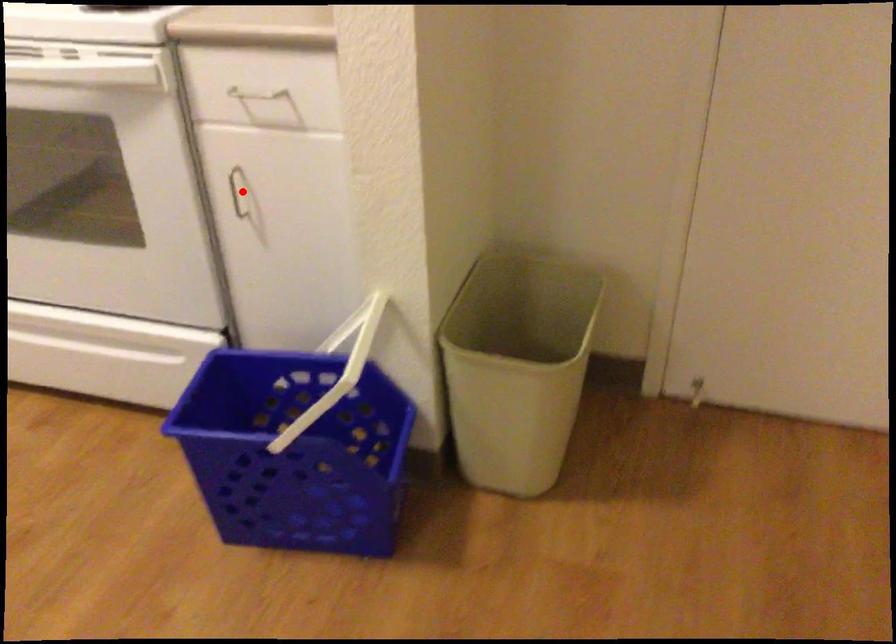
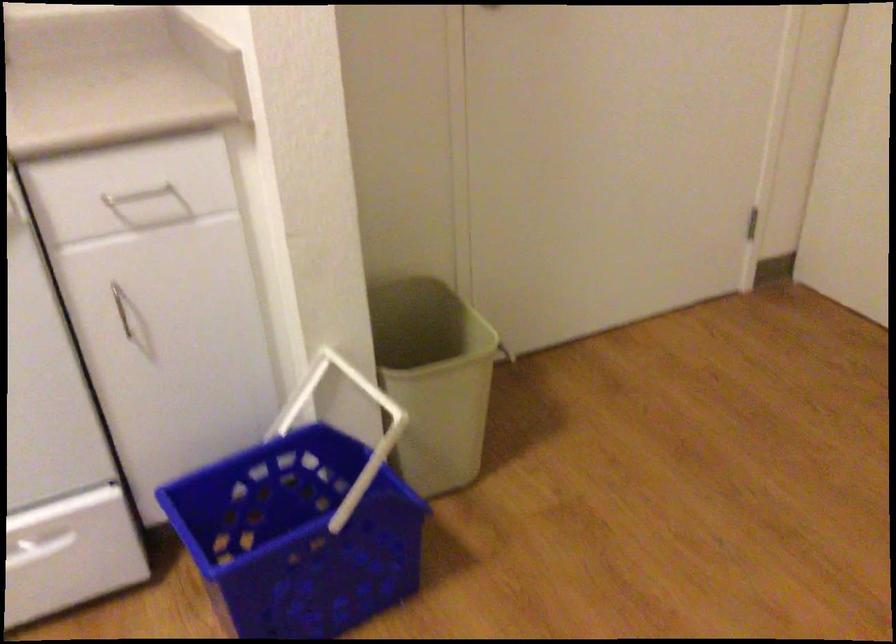
Find the pixel in the second image that matches the highlighted location in the first image.

(121, 307)